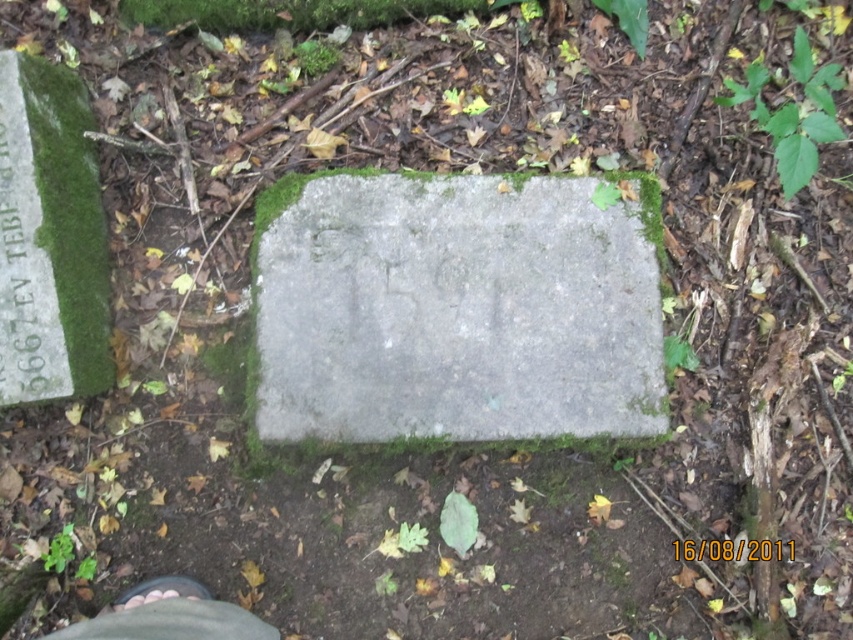
Question: Can you confirm if gray concrete at center is positioned to the right of brown leather shoe at lower left?

Choices:
 (A) yes
 (B) no

Answer: (A)

Question: Considering the relative positions of gray concrete at center and brown leather shoe at lower left in the image provided, where is gray concrete at center located with respect to brown leather shoe at lower left?

Choices:
 (A) left
 (B) right

Answer: (B)

Question: Which of the following is the farthest from the observer?

Choices:
 (A) (112, 604)
 (B) (546, 285)

Answer: (B)

Question: Does gray concrete at center have a lesser width compared to brown leather shoe at lower left?

Choices:
 (A) yes
 (B) no

Answer: (B)